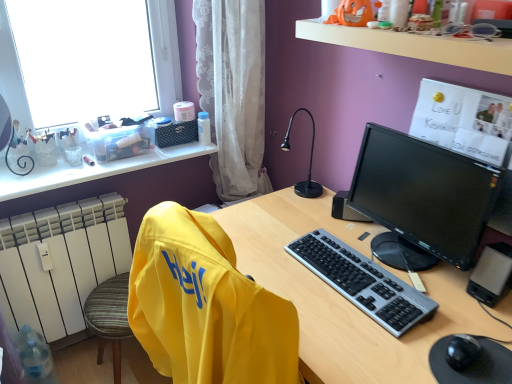
The height and width of the screenshot is (384, 512). What are the coordinates of `vacant space that's between black rubber mouse at lower right and black plastic computer tower at lower right` in the screenshot? It's located at (475, 316).